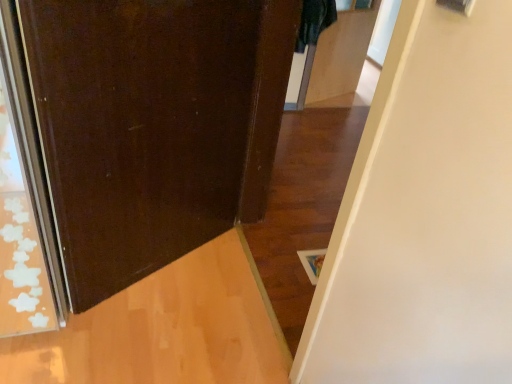
You are a GUI agent. You are given a task and a screenshot of the screen. Output one action in this format:
    pyautogui.click(x=<x>, y=<y>)
    Task: Click on the matte brown door at center, the first door positioned from the right
    
    Given the screenshot: What is the action you would take?
    pyautogui.click(x=425, y=214)

The height and width of the screenshot is (384, 512). Describe the element at coordinates (425, 214) in the screenshot. I see `matte brown door at center, the 2th door when ordered from left to right` at that location.

Measure the distance between point (222, 168) and camera.

The depth of point (222, 168) is 1.78 meters.

Describe the element at coordinates (154, 125) in the screenshot. I see `matte brown door at left, placed as the 1th door when sorted from left to right` at that location.

The height and width of the screenshot is (384, 512). In order to click on matte brown door at left, the second door when ordered from right to left in this screenshot , I will do `click(154, 125)`.

I want to click on matte brown door at center, the first door positioned from the right, so click(x=425, y=214).

Between matte brown door at center, the 2th door when ordered from left to right, and matte brown door at left, placed as the 1th door when sorted from left to right, which one appears on the right side from the viewer's perspective?

matte brown door at center, the 2th door when ordered from left to right, is more to the right.

Does matte brown door at center, the 2th door when ordered from left to right, come in front of matte brown door at left, the second door when ordered from right to left?

Yes, it is in front of matte brown door at left, the second door when ordered from right to left.

Is point (506, 263) positioned in front of point (206, 145)?

Yes, point (506, 263) is in front of point (206, 145).

From the image's perspective, between matte brown door at center, the 2th door when ordered from left to right, and matte brown door at left, the second door when ordered from right to left, who is located below?

matte brown door at left, the second door when ordered from right to left.

From a real-world perspective, which is physically below, matte brown door at center, the 2th door when ordered from left to right, or matte brown door at left, placed as the 1th door when sorted from left to right?

In real-world perspective, matte brown door at left, placed as the 1th door when sorted from left to right, is lower.

Considering the relative sizes of matte brown door at center, the 2th door when ordered from left to right, and matte brown door at left, placed as the 1th door when sorted from left to right, in the image provided, is matte brown door at center, the 2th door when ordered from left to right, wider than matte brown door at left, placed as the 1th door when sorted from left to right,?

Indeed, matte brown door at center, the 2th door when ordered from left to right, has a greater width compared to matte brown door at left, placed as the 1th door when sorted from left to right.

Does matte brown door at center, the first door positioned from the right, have a greater height compared to matte brown door at left, the second door when ordered from right to left?

Yes.

Between matte brown door at center, the 2th door when ordered from left to right, and matte brown door at left, the second door when ordered from right to left, which one has smaller size?

With smaller size is matte brown door at left, the second door when ordered from right to left.

Can matte brown door at left, placed as the 1th door when sorted from left to right, be found inside matte brown door at center, the first door positioned from the right?

No, matte brown door at center, the first door positioned from the right, does not contain matte brown door at left, placed as the 1th door when sorted from left to right.

Is matte brown door at center, the 2th door when ordered from left to right, placed right next to matte brown door at left, placed as the 1th door when sorted from left to right?

No, matte brown door at center, the 2th door when ordered from left to right, is not beside matte brown door at left, placed as the 1th door when sorted from left to right.

Could you tell me if matte brown door at center, the 2th door when ordered from left to right, is turned towards matte brown door at left, placed as the 1th door when sorted from left to right?

Yes, matte brown door at center, the 2th door when ordered from left to right, is oriented towards matte brown door at left, placed as the 1th door when sorted from left to right.

How different are the orientations of matte brown door at center, the 2th door when ordered from left to right, and matte brown door at left, the second door when ordered from right to left, in degrees?

A: They differ by 120 degrees in their facing directions.

Locate an element on the screen. Image resolution: width=512 pixels, height=384 pixels. door below the matte brown door at center, the 2th door when ordered from left to right (from a real-world perspective) is located at coordinates (154, 125).

Based on their positions, is matte brown door at left, the second door when ordered from right to left, located to the left or right of matte brown door at center, the first door positioned from the right?

Based on their positions, matte brown door at left, the second door when ordered from right to left, is located to the left of matte brown door at center, the first door positioned from the right.

Considering the positions of objects matte brown door at left, the second door when ordered from right to left, and matte brown door at center, the first door positioned from the right, in the image provided, who is behind, matte brown door at left, the second door when ordered from right to left, or matte brown door at center, the first door positioned from the right,?

matte brown door at left, the second door when ordered from right to left, is further from the camera.

Does point (179, 240) appear closer or farther from the camera than point (442, 297)?

Point (179, 240) is positioned farther from the camera compared to point (442, 297).

From the image's perspective, between matte brown door at left, the second door when ordered from right to left, and matte brown door at center, the 2th door when ordered from left to right, who is located below?

matte brown door at left, the second door when ordered from right to left, is shown below in the image.

From a real-world perspective, between matte brown door at left, the second door when ordered from right to left, and matte brown door at center, the 2th door when ordered from left to right, who is vertically higher?

matte brown door at center, the 2th door when ordered from left to right.

Is matte brown door at left, the second door when ordered from right to left, thinner than matte brown door at center, the 2th door when ordered from left to right?

Indeed, matte brown door at left, the second door when ordered from right to left, has a lesser width compared to matte brown door at center, the 2th door when ordered from left to right.

Based on the photo, between matte brown door at left, the second door when ordered from right to left, and matte brown door at center, the first door positioned from the right, which one has more height?

Standing taller between the two is matte brown door at center, the first door positioned from the right.

Considering the relative sizes of matte brown door at left, the second door when ordered from right to left, and matte brown door at center, the first door positioned from the right, in the image provided, is matte brown door at left, the second door when ordered from right to left, bigger than matte brown door at center, the first door positioned from the right,?

Actually, matte brown door at left, the second door when ordered from right to left, might be smaller than matte brown door at center, the first door positioned from the right.

Does matte brown door at left, placed as the 1th door when sorted from left to right, contain matte brown door at center, the 2th door when ordered from left to right?

That's incorrect, matte brown door at center, the 2th door when ordered from left to right, is not inside matte brown door at left, placed as the 1th door when sorted from left to right.

Is matte brown door at left, the second door when ordered from right to left, oriented away from matte brown door at center, the 2th door when ordered from left to right?

That's not correct — matte brown door at left, the second door when ordered from right to left, is not looking away from matte brown door at center, the 2th door when ordered from left to right.

What's the angular difference between matte brown door at left, the second door when ordered from right to left, and matte brown door at center, the first door positioned from the right,'s facing directions?

The angle between the facing direction of matte brown door at left, the second door when ordered from right to left, and the facing direction of matte brown door at center, the first door positioned from the right, is 120 degrees.

Where is `door that appears below the matte brown door at center, the 2th door when ordered from left to right (from the image's perspective)`? door that appears below the matte brown door at center, the 2th door when ordered from left to right (from the image's perspective) is located at coordinates (154, 125).

You are a GUI agent. You are given a task and a screenshot of the screen. Output one action in this format:
    pyautogui.click(x=<x>, y=<y>)
    Task: Click on the door that is above the matte brown door at left, placed as the 1th door when sorted from left to right (from the image's perspective)
    
    Given the screenshot: What is the action you would take?
    pyautogui.click(x=425, y=214)

You are a GUI agent. You are given a task and a screenshot of the screen. Output one action in this format:
    pyautogui.click(x=<x>, y=<y>)
    Task: Click on the door that is in front of the matte brown door at left, placed as the 1th door when sorted from left to right
    
    Given the screenshot: What is the action you would take?
    pyautogui.click(x=425, y=214)